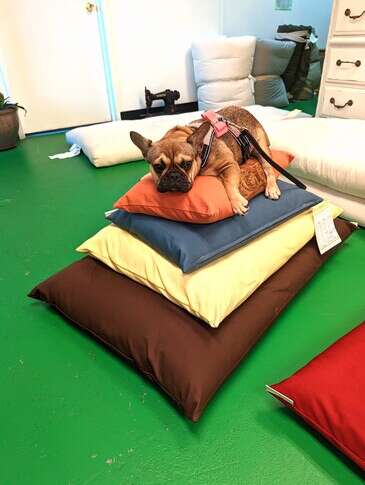
What are the coordinates of `drawer` in the screenshot? It's located at (350, 11), (359, 53), (335, 108).